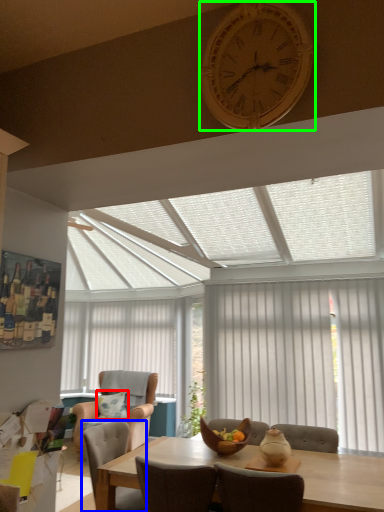
Question: Estimate the real-world distances between objects in this image. Which object is farther from pillow (highlighted by a red box), chair (highlighted by a blue box) or clock (highlighted by a green box)?

Choices:
 (A) chair
 (B) clock

Answer: (B)